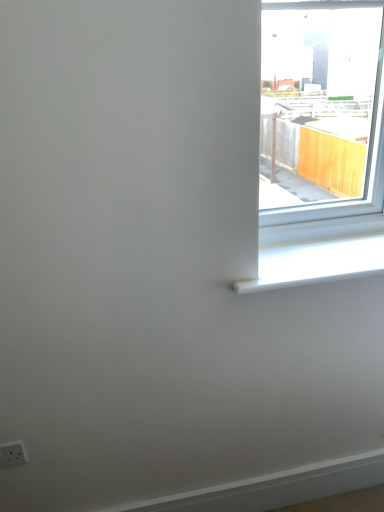
This screenshot has width=384, height=512. I want to click on vacant point above white plastic window sill at upper right (from a real-world perspective), so click(304, 256).